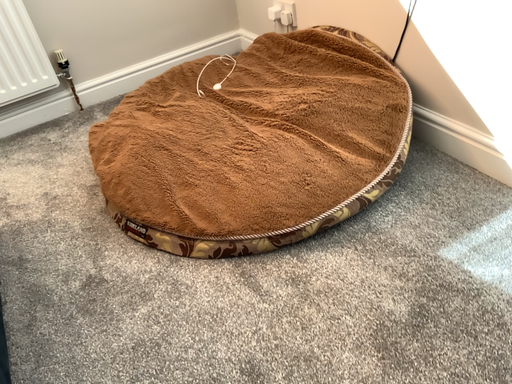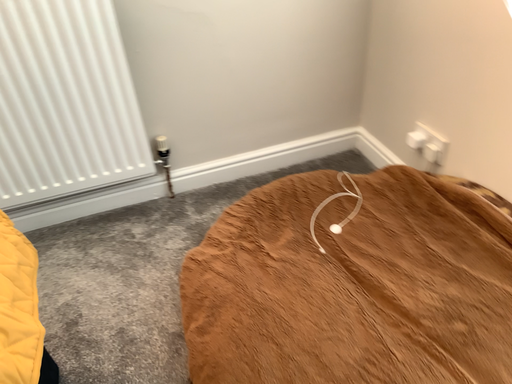
Question: How did the camera likely rotate when shooting the video?

Choices:
 (A) rotated left
 (B) rotated right

Answer: (A)